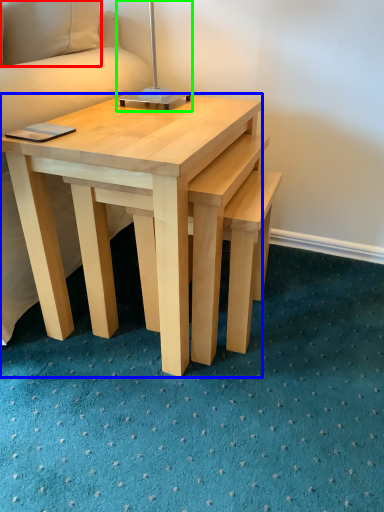
Question: Based on their relative distances, which object is farther from pillow (highlighted by a red box)? Choose from coffee table (highlighted by a blue box) and bedside lamp (highlighted by a green box).

Choices:
 (A) coffee table
 (B) bedside lamp

Answer: (A)